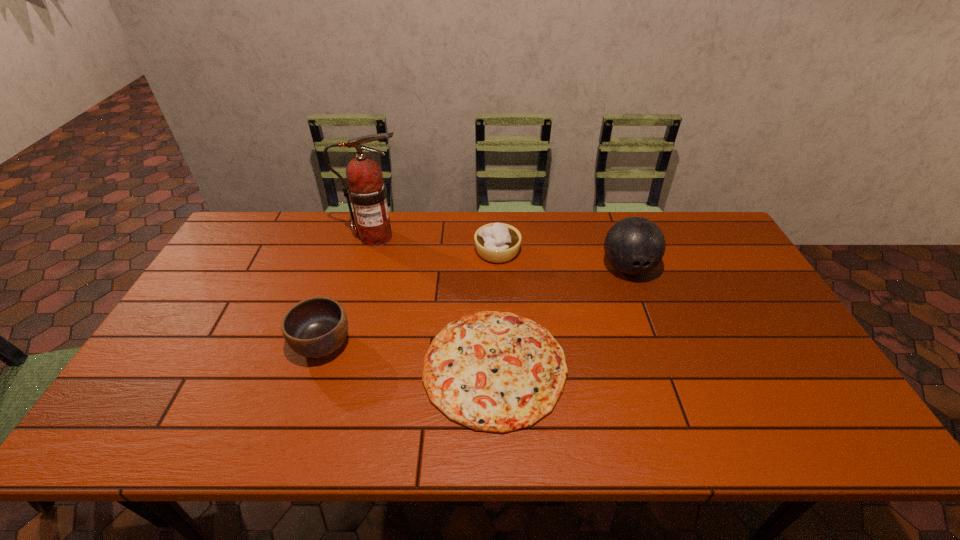
Identify the location of vacant space that is in between the pizza and the bowl. Image resolution: width=960 pixels, height=540 pixels. (409, 356).

Image resolution: width=960 pixels, height=540 pixels. Find the location of `blank region between the pizza and the whipped cream`. blank region between the pizza and the whipped cream is located at coordinates (496, 309).

Find the location of a particular element. Image resolution: width=960 pixels, height=540 pixels. free point between the rightmost object and the shortest object is located at coordinates (562, 318).

The height and width of the screenshot is (540, 960). Identify the location of the closest object to the bowl. (491, 371).

Identify which object is the closest to the whipped cream. Please provide its 2D coordinates. Your answer should be formatted as a tuple, i.e. [(x, y)], where the tuple contains the x and y coordinates of a point satisfying the conditions above.

[(491, 371)]

Identify the location of free space in the image that satisfies the following two spatial constraints: 1. at the nozzle of the whipped cream; 2. on the left side of the fire extinguisher. (372, 252).